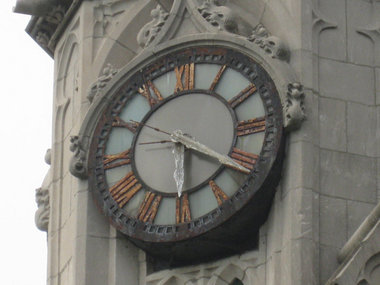
You are a GUI agent. You are given a task and a screenshot of the screen. Output one action in this format:
    pyautogui.click(x=<x>, y=<y>)
    Task: Click on the space below clock
    This screenshot has height=285, width=380.
    Given the screenshot: What is the action you would take?
    pyautogui.click(x=197, y=275)